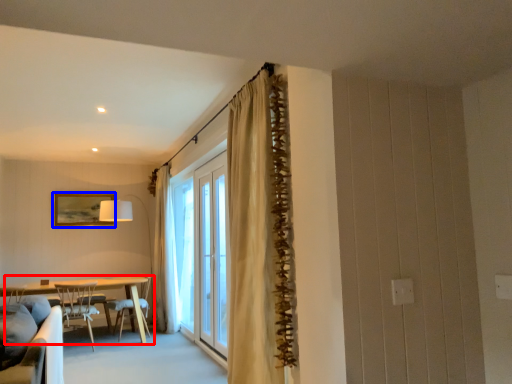
Question: Which object is closer to the camera taking this photo, kitchen & dining room table (highlighted by a red box) or picture frame (highlighted by a blue box)?

Choices:
 (A) kitchen & dining room table
 (B) picture frame

Answer: (A)